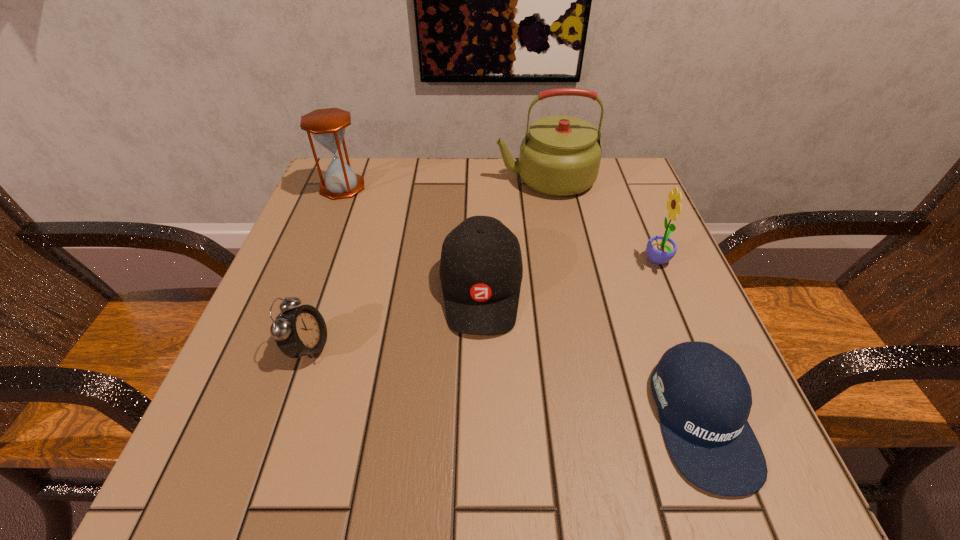
I want to click on hourglass at the left edge, so click(x=327, y=126).

Locate an element on the screen. The image size is (960, 540). alarm clock at the left edge is located at coordinates (300, 331).

This screenshot has height=540, width=960. Find the location of `kettle situated at the right edge`. kettle situated at the right edge is located at coordinates pyautogui.click(x=560, y=156).

Where is `sunflower that is at the right edge`? This screenshot has width=960, height=540. sunflower that is at the right edge is located at coordinates (660, 249).

Find the location of a particular element. baseball cap that is at the right edge is located at coordinates (704, 399).

You are a GUI agent. You are given a task and a screenshot of the screen. Output one action in this format:
    pyautogui.click(x=<x>, y=<y>)
    Task: Click on the object that is at the far left corner
    This screenshot has height=540, width=960.
    Given the screenshot: What is the action you would take?
    pyautogui.click(x=327, y=126)

The height and width of the screenshot is (540, 960). Identify the location of object at the far right corner. (560, 156).

Locate an element on the screen. object located at the near right corner is located at coordinates (704, 399).

The width and height of the screenshot is (960, 540). I want to click on vacant space at the far edge, so click(403, 195).

At what (x,y) coordinates should I click in order to perform the action: click on free space at the near edge. Please return your answer as a coordinate pair (x, y). The height and width of the screenshot is (540, 960). Looking at the image, I should click on (417, 471).